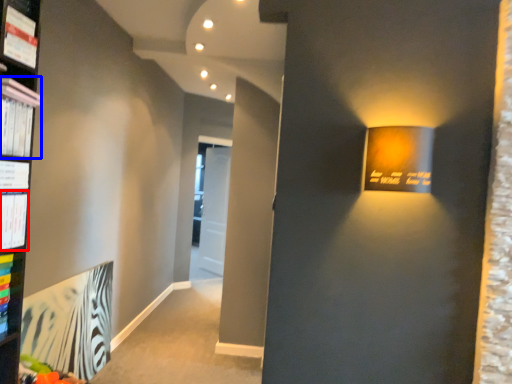
Question: Which object appears closest to the camera in this image, paperback book (highlighted by a red box) or magazine (highlighted by a blue box)?

Choices:
 (A) paperback book
 (B) magazine

Answer: (B)